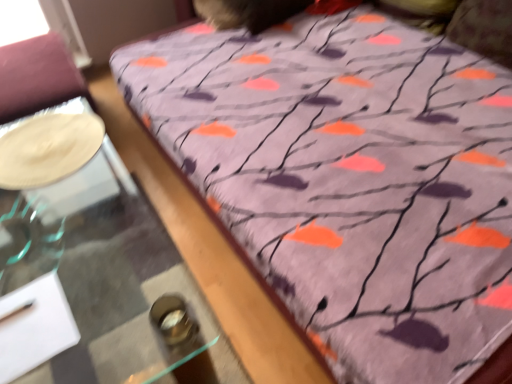
Locate an element on the screen. The width and height of the screenshot is (512, 384). free space above white glossy plate at left (from a real-world perspective) is located at coordinates (30, 145).